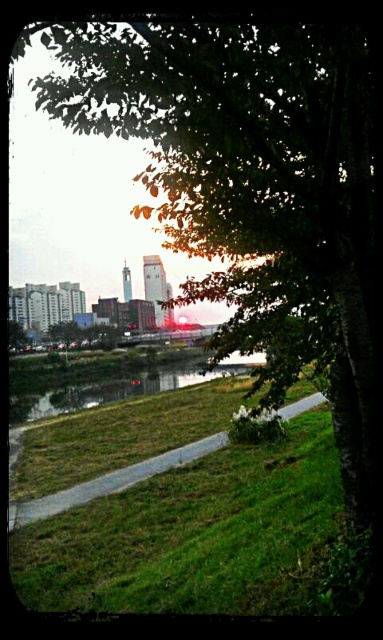
Can you confirm if green grass at lower left is positioned below green grassy river at lower center?

Yes, green grass at lower left is below green grassy river at lower center.

Is green grass at lower left wider than green grassy river at lower center?

In fact, green grass at lower left might be narrower than green grassy river at lower center.

This screenshot has height=640, width=383. Describe the element at coordinates (198, 534) in the screenshot. I see `green grass at lower left` at that location.

Find the location of a particular element. This screenshot has height=640, width=383. green grass at lower left is located at coordinates (198, 534).

Image resolution: width=383 pixels, height=640 pixels. What do you see at coordinates (122, 388) in the screenshot?
I see `green grassy river at lower center` at bounding box center [122, 388].

Does green grassy river at lower center appear on the right side of green leafy tree at lower left?

Indeed, green grassy river at lower center is positioned on the right side of green leafy tree at lower left.

What do you see at coordinates (122, 388) in the screenshot?
I see `green grassy river at lower center` at bounding box center [122, 388].

Find the location of a particular element. green grassy river at lower center is located at coordinates (122, 388).

Which is behind, point (176, 480) or point (26, 333)?

The point (26, 333) is behind.

Does green grass at lower left appear on the left side of green leafy tree at lower left?

In fact, green grass at lower left is to the right of green leafy tree at lower left.

Who is more forward, (130, 538) or (11, 349)?

Point (130, 538)

This screenshot has width=383, height=640. Find the location of `green grass at lower left`. green grass at lower left is located at coordinates (198, 534).